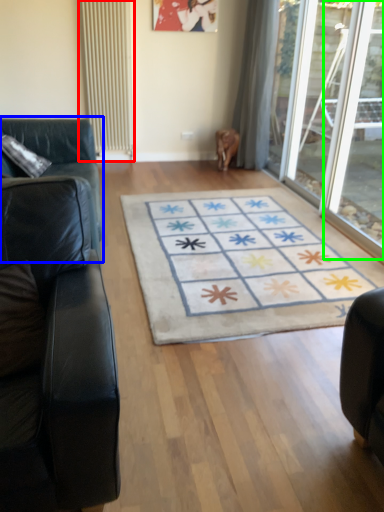
Question: Which object is positioned farthest from radiator (highlighted by a red box)? Select from studio couch (highlighted by a blue box) and glass door (highlighted by a green box).

Choices:
 (A) studio couch
 (B) glass door

Answer: (B)